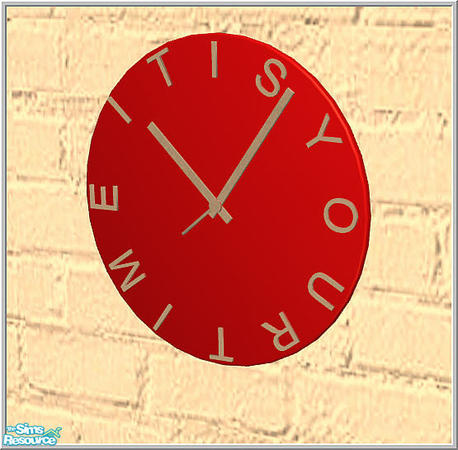
The width and height of the screenshot is (458, 450). I want to click on clock, so click(291, 263).